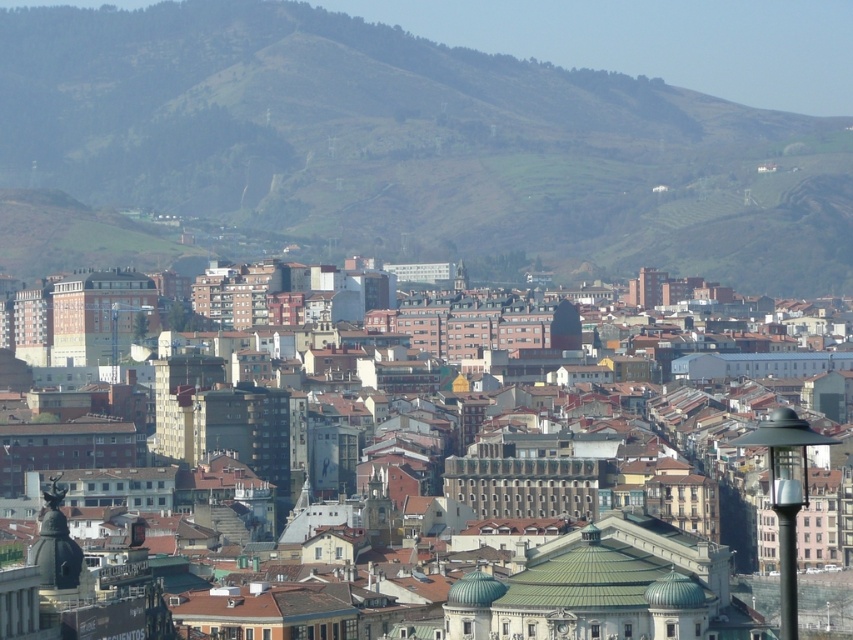
You are a city planner reviewing this area. You need to install a new streetlight between the green grassy hillside at upper center and the matte black lamp post at right. Based on their positions, where should the new streetlight be placed?

The new streetlight should be placed to the right of the green grassy hillside at upper center and to the left of the matte black lamp post at right since the green grassy hillside at upper center is positioned on the left side of the matte black lamp post at right.

Based on the photo, you are a city planner assessing the view from a new observation deck. The deck is located in the foreground urban area. You want to ensure that the green grassy hillside at upper center remains visible from the deck. Considering the height of the matte black lamp post at right, will the hillside obstruct the view of the lamp post?

The green grassy hillside at upper center is taller than the matte black lamp post at right, so the hillside may obstruct the view of the lamp post from the observation deck depending on their relative positions and distances.